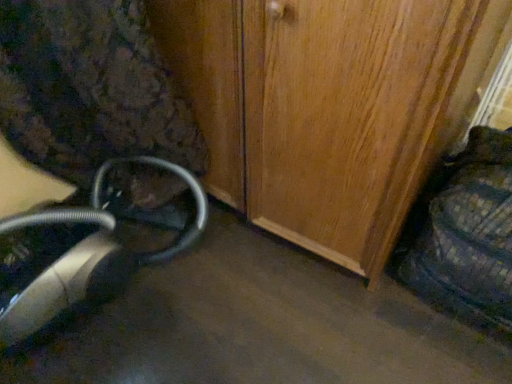
In order to click on free spot below metallic silver vacuum cleaner at lower left (from a real-world perspective) in this screenshot , I will do `click(115, 292)`.